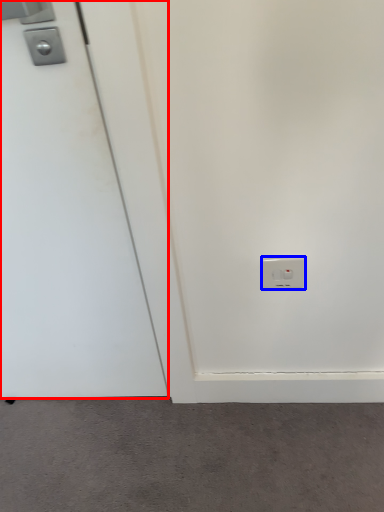
Question: Among these objects, which one is nearest to the camera, door (highlighted by a red box) or power plugs and sockets (highlighted by a blue box)?

Choices:
 (A) door
 (B) power plugs and sockets

Answer: (A)